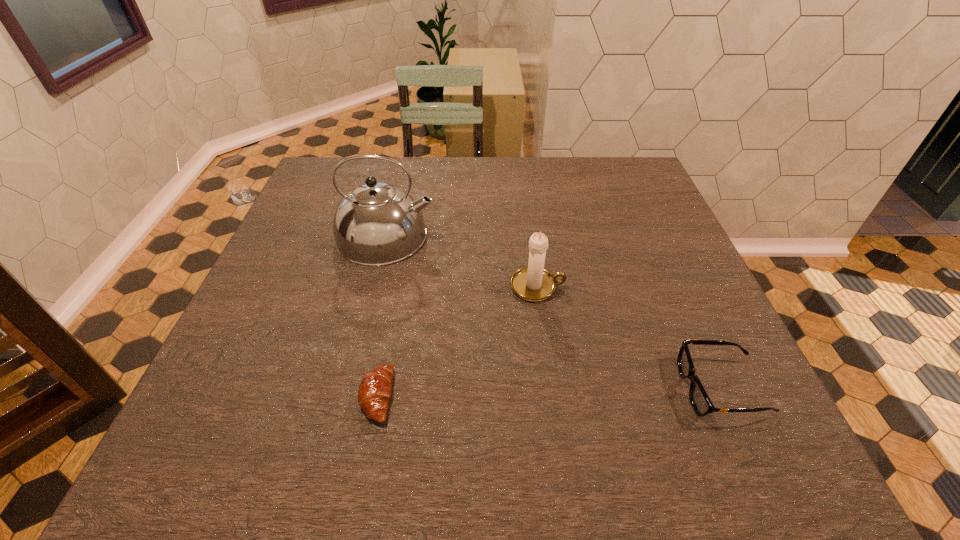
You are a GUI agent. You are given a task and a screenshot of the screen. Output one action in this format:
    pyautogui.click(x=<x>, y=<y>)
    Task: Click on the tallest object
    
    Given the screenshot: What is the action you would take?
    pyautogui.click(x=377, y=223)

The image size is (960, 540). In order to click on the farthest object in this screenshot , I will do `click(377, 223)`.

Find the location of a particular element. The width and height of the screenshot is (960, 540). the third shortest object is located at coordinates (533, 283).

Image resolution: width=960 pixels, height=540 pixels. I want to click on the third nearest object, so [533, 283].

The height and width of the screenshot is (540, 960). I want to click on the third tallest object, so click(700, 401).

What are the coordinates of `the rightmost object` in the screenshot? It's located at (700, 401).

At what (x,y) coordinates should I click in order to perform the action: click on the shortest object. Please return your answer as a coordinate pair (x, y). Image resolution: width=960 pixels, height=540 pixels. Looking at the image, I should click on (375, 389).

Image resolution: width=960 pixels, height=540 pixels. I want to click on vacant space situated 0.330m from the spout of the tallest object, so click(x=564, y=236).

You are a GUI agent. You are given a task and a screenshot of the screen. Output one action in this format:
    pyautogui.click(x=<x>, y=<y>)
    Task: Click on the vacant space located on the handle side of the third object from left to right
    This screenshot has width=960, height=540.
    Given the screenshot: What is the action you would take?
    pyautogui.click(x=587, y=287)

At what (x,y) coordinates should I click in order to perform the action: click on blank space located 0.390m on the front-facing side of the rightmost object. Please return your answer as a coordinate pair (x, y). Image resolution: width=960 pixels, height=540 pixels. Looking at the image, I should click on (471, 388).